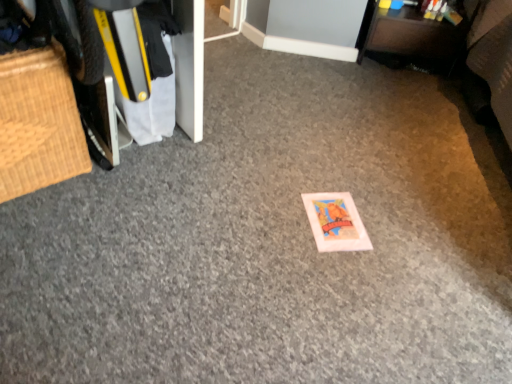
Where is `brown fabric drawer at upper right, the second furniture when ordered from left to right`? Image resolution: width=512 pixels, height=384 pixels. brown fabric drawer at upper right, the second furniture when ordered from left to right is located at coordinates (410, 39).

Describe the element at coordinates (410, 39) in the screenshot. I see `brown fabric drawer at upper right, the second furniture when ordered from left to right` at that location.

This screenshot has width=512, height=384. I want to click on bamboo mat at left, the second furniture in the top-to-bottom sequence, so click(38, 122).

Describe the element at coordinates (38, 122) in the screenshot. Image resolution: width=512 pixels, height=384 pixels. I see `bamboo mat at left, the second furniture in the top-to-bottom sequence` at that location.

Identify the location of brown fabric drawer at upper right, arranged as the first furniture when viewed from the top. The width and height of the screenshot is (512, 384). (410, 39).

Considering the relative positions of bamboo mat at left, which ranks as the first furniture in bottom-to-top order, and brown fabric drawer at upper right, the second furniture when ordered from left to right, in the image provided, is bamboo mat at left, which ranks as the first furniture in bottom-to-top order, to the left or to the right of brown fabric drawer at upper right, the second furniture when ordered from left to right,?

Clearly, bamboo mat at left, which ranks as the first furniture in bottom-to-top order, is on the left of brown fabric drawer at upper right, the second furniture when ordered from left to right, in the image.

Is bamboo mat at left, which ranks as the first furniture in front-to-back order, closer to the viewer compared to brown fabric drawer at upper right, arranged as the first furniture when viewed from the top?

Yes, bamboo mat at left, which ranks as the first furniture in front-to-back order, is in front of brown fabric drawer at upper right, arranged as the first furniture when viewed from the top.

Considering the points (61, 129) and (365, 35), which point is behind, point (61, 129) or point (365, 35)?

The point (365, 35) is more distant.

From the image's perspective, between bamboo mat at left, the second furniture in the top-to-bottom sequence, and brown fabric drawer at upper right, acting as the first furniture starting from the right, who is located below?

bamboo mat at left, the second furniture in the top-to-bottom sequence, is shown below in the image.

From a real-world perspective, which is physically above, bamboo mat at left, which ranks as the first furniture in front-to-back order, or brown fabric drawer at upper right, acting as the first furniture starting from the right?

bamboo mat at left, which ranks as the first furniture in front-to-back order, from a real-world perspective.

Considering the relative sizes of bamboo mat at left, the second furniture in the top-to-bottom sequence, and brown fabric drawer at upper right, the second furniture when ordered from left to right, in the image provided, is bamboo mat at left, the second furniture in the top-to-bottom sequence, wider than brown fabric drawer at upper right, the second furniture when ordered from left to right,?

Indeed, bamboo mat at left, the second furniture in the top-to-bottom sequence, has a greater width compared to brown fabric drawer at upper right, the second furniture when ordered from left to right.

Considering the sizes of bamboo mat at left, marked as the 2th furniture in a back-to-front arrangement, and brown fabric drawer at upper right, the 2th furniture in the bottom-to-top sequence, in the image, is bamboo mat at left, marked as the 2th furniture in a back-to-front arrangement, taller or shorter than brown fabric drawer at upper right, the 2th furniture in the bottom-to-top sequence,?

Clearly, bamboo mat at left, marked as the 2th furniture in a back-to-front arrangement, is taller compared to brown fabric drawer at upper right, the 2th furniture in the bottom-to-top sequence.

From the picture: Considering the sizes of objects bamboo mat at left, positioned as the 2th furniture in right-to-left order, and brown fabric drawer at upper right, acting as the first furniture starting from the right, in the image provided, who is smaller, bamboo mat at left, positioned as the 2th furniture in right-to-left order, or brown fabric drawer at upper right, acting as the first furniture starting from the right,?

brown fabric drawer at upper right, acting as the first furniture starting from the right, is smaller.

Do you think bamboo mat at left, which ranks as the first furniture in front-to-back order, is within brown fabric drawer at upper right, the 2th furniture in the bottom-to-top sequence, or outside of it?

bamboo mat at left, which ranks as the first furniture in front-to-back order, is spatially situated outside brown fabric drawer at upper right, the 2th furniture in the bottom-to-top sequence.

From the picture: Is bamboo mat at left, which ranks as the first furniture in bottom-to-top order, with brown fabric drawer at upper right, arranged as the first furniture when viewed from the top?

There is a gap between bamboo mat at left, which ranks as the first furniture in bottom-to-top order, and brown fabric drawer at upper right, arranged as the first furniture when viewed from the top.

In the scene shown: Could you tell me if bamboo mat at left, which ranks as the first furniture in front-to-back order, is facing brown fabric drawer at upper right, which is counted as the 2th furniture, starting from the front?

No, bamboo mat at left, which ranks as the first furniture in front-to-back order, is not oriented towards brown fabric drawer at upper right, which is counted as the 2th furniture, starting from the front.

How different are the orientations of bamboo mat at left, the second furniture in the top-to-bottom sequence, and brown fabric drawer at upper right, arranged as the first furniture when viewed from the top, in degrees?

The facing directions of bamboo mat at left, the second furniture in the top-to-bottom sequence, and brown fabric drawer at upper right, arranged as the first furniture when viewed from the top, are 45.1 degrees apart.

Where is `furniture below the bamboo mat at left, marked as the 1th furniture in a left-to-right arrangement (from a real-world perspective)`? Image resolution: width=512 pixels, height=384 pixels. furniture below the bamboo mat at left, marked as the 1th furniture in a left-to-right arrangement (from a real-world perspective) is located at coordinates (410, 39).

Does brown fabric drawer at upper right, the 2th furniture in the bottom-to-top sequence, appear on the right side of bamboo mat at left, marked as the 1th furniture in a left-to-right arrangement?

Yes, brown fabric drawer at upper right, the 2th furniture in the bottom-to-top sequence, is to the right of bamboo mat at left, marked as the 1th furniture in a left-to-right arrangement.

Does brown fabric drawer at upper right, arranged as the first furniture when viewed from the top, lie in front of bamboo mat at left, positioned as the 2th furniture in right-to-left order?

No, the depth of brown fabric drawer at upper right, arranged as the first furniture when viewed from the top, is greater than that of bamboo mat at left, positioned as the 2th furniture in right-to-left order.

Considering the points (399, 50) and (15, 123), which point is in front, point (399, 50) or point (15, 123)?

Point (15, 123)

From the image's perspective, does brown fabric drawer at upper right, the 2th furniture in the bottom-to-top sequence, appear lower than bamboo mat at left, which ranks as the first furniture in bottom-to-top order?

Incorrect, from the image's perspective, brown fabric drawer at upper right, the 2th furniture in the bottom-to-top sequence, is higher than bamboo mat at left, which ranks as the first furniture in bottom-to-top order.

From a real-world perspective, does brown fabric drawer at upper right, arranged as the first furniture when viewed from the top, sit lower than bamboo mat at left, positioned as the 2th furniture in right-to-left order?

Yes, from a real-world perspective, brown fabric drawer at upper right, arranged as the first furniture when viewed from the top, is beneath bamboo mat at left, positioned as the 2th furniture in right-to-left order.

Is brown fabric drawer at upper right, arranged as the first furniture when viewed from the top, wider or thinner than bamboo mat at left, positioned as the 2th furniture in right-to-left order?

In the image, brown fabric drawer at upper right, arranged as the first furniture when viewed from the top, appears to be more narrow than bamboo mat at left, positioned as the 2th furniture in right-to-left order.

In the scene shown: Is brown fabric drawer at upper right, the 2th furniture in the bottom-to-top sequence, taller or shorter than bamboo mat at left, which ranks as the first furniture in front-to-back order?

Clearly, brown fabric drawer at upper right, the 2th furniture in the bottom-to-top sequence, is shorter compared to bamboo mat at left, which ranks as the first furniture in front-to-back order.

Between brown fabric drawer at upper right, which is counted as the 2th furniture, starting from the front, and bamboo mat at left, the second furniture in the top-to-bottom sequence, which one has smaller size?

With smaller size is brown fabric drawer at upper right, which is counted as the 2th furniture, starting from the front.

Would you say brown fabric drawer at upper right, which is counted as the 2th furniture, starting from the front, contains bamboo mat at left, positioned as the 2th furniture in right-to-left order?

No.

Is the surface of brown fabric drawer at upper right, the 2th furniture in the bottom-to-top sequence, in direct contact with bamboo mat at left, which ranks as the first furniture in front-to-back order?

brown fabric drawer at upper right, the 2th furniture in the bottom-to-top sequence, and bamboo mat at left, which ranks as the first furniture in front-to-back order, are clearly separated.

Is brown fabric drawer at upper right, arranged as the first furniture when viewed from the top, oriented away from bamboo mat at left, marked as the 2th furniture in a back-to-front arrangement?

No.

What's the angular difference between brown fabric drawer at upper right, acting as the first furniture starting from the right, and bamboo mat at left, marked as the 1th furniture in a left-to-right arrangement,'s facing directions?

The angle between the facing direction of brown fabric drawer at upper right, acting as the first furniture starting from the right, and the facing direction of bamboo mat at left, marked as the 1th furniture in a left-to-right arrangement, is 45.1 degrees.

Locate an element on the screen. This screenshot has height=384, width=512. furniture above the bamboo mat at left, marked as the 1th furniture in a left-to-right arrangement (from the image's perspective) is located at coordinates (410, 39).

In the image, there is a bamboo mat at left, which ranks as the first furniture in front-to-back order. At what (x,y) coordinates should I click in order to perform the action: click on furniture above it (from the image's perspective). Please return your answer as a coordinate pair (x, y). The width and height of the screenshot is (512, 384). Looking at the image, I should click on (410, 39).

Find the location of a particular element. furniture on the right side of bamboo mat at left, the second furniture in the top-to-bottom sequence is located at coordinates (x=410, y=39).